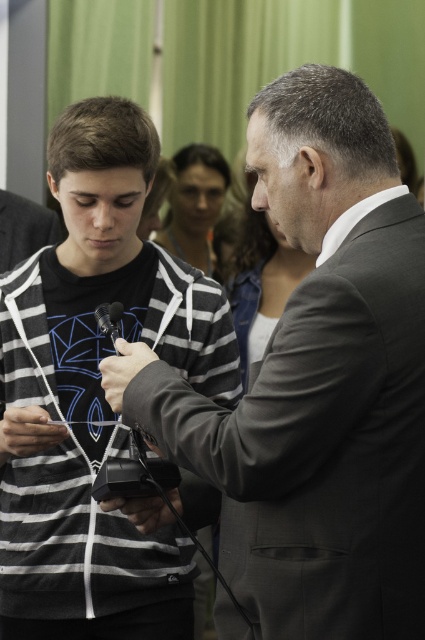
Question: Is the position of gray suit at center more distant than that of silver metallic microphone at center?

Choices:
 (A) yes
 (B) no

Answer: (B)

Question: Which of the following is the farthest from the observer?

Choices:
 (A) gray suit at center
 (B) black striped hoodie at left

Answer: (B)

Question: Is the position of gray suit at center less distant than that of silver metallic microphone at center?

Choices:
 (A) yes
 (B) no

Answer: (A)

Question: Which object is farther from the camera taking this photo?

Choices:
 (A) black striped hoodie at left
 (B) gray suit at center
 (C) silver metallic microphone at center

Answer: (A)

Question: Which point is closer to the camera?

Choices:
 (A) (178, 323)
 (B) (345, 600)

Answer: (B)

Question: Does gray suit at center appear on the left side of silver metallic microphone at center?

Choices:
 (A) no
 (B) yes

Answer: (A)